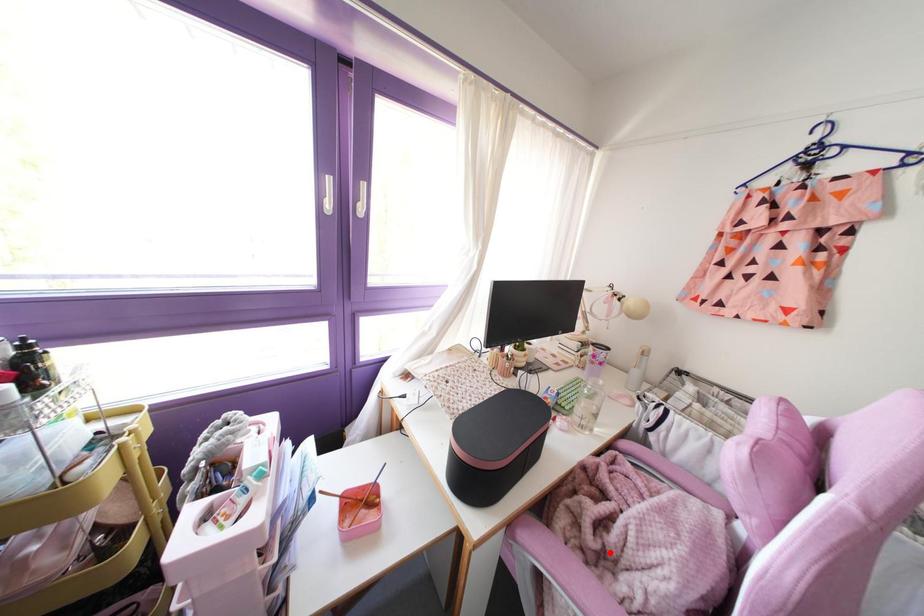
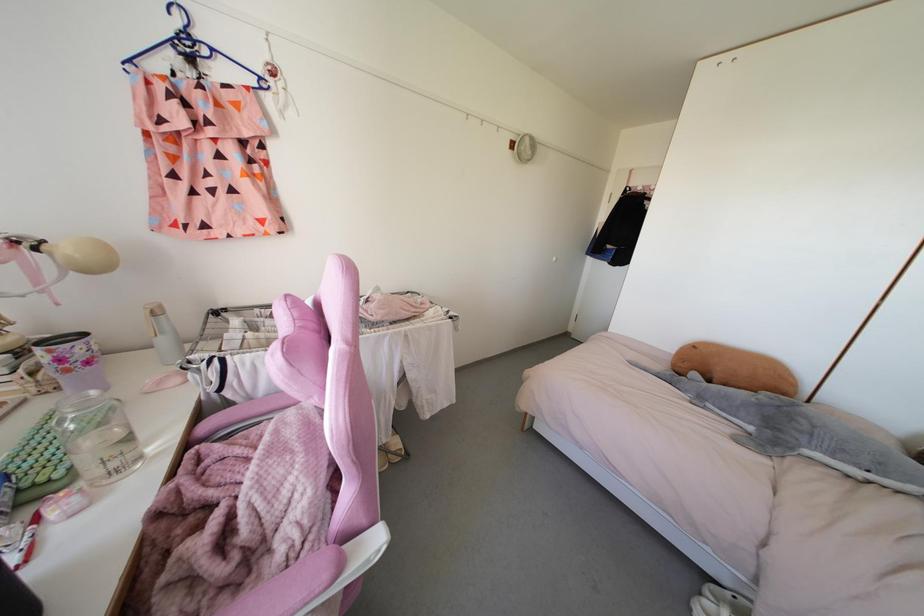
Where in the second image is the point corresponding to the highlighted location from the first image?

(252, 543)